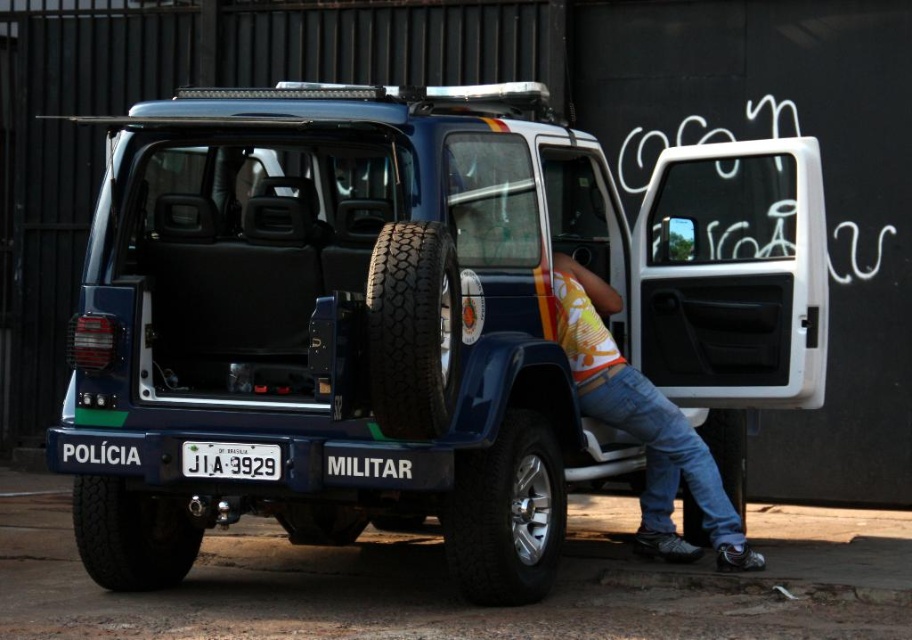
You are a photographer trying to capture both the denim jeans at lower right and the white plastic license plate at center in a single frame. Which object should you zoom out to include both?

The denim jeans at lower right is larger in size than the white plastic license plate at center, so you should zoom out to include both the denim jeans at lower right and the white plastic license plate at center.

What is the exact location of the black rubber tire at lower left in the image?

The black rubber tire at lower left is located at point coordinates of (131, 536).

You are a mechanic trying to access the white plastic license plate at center to clean it. The black rubber tire at lower left is blocking your path. Can you reach the license plate without moving the tire?

The black rubber tire at lower left is 30.14 inches away from the white plastic license plate at center, so there is enough space between them to reach the license plate without moving the tire.